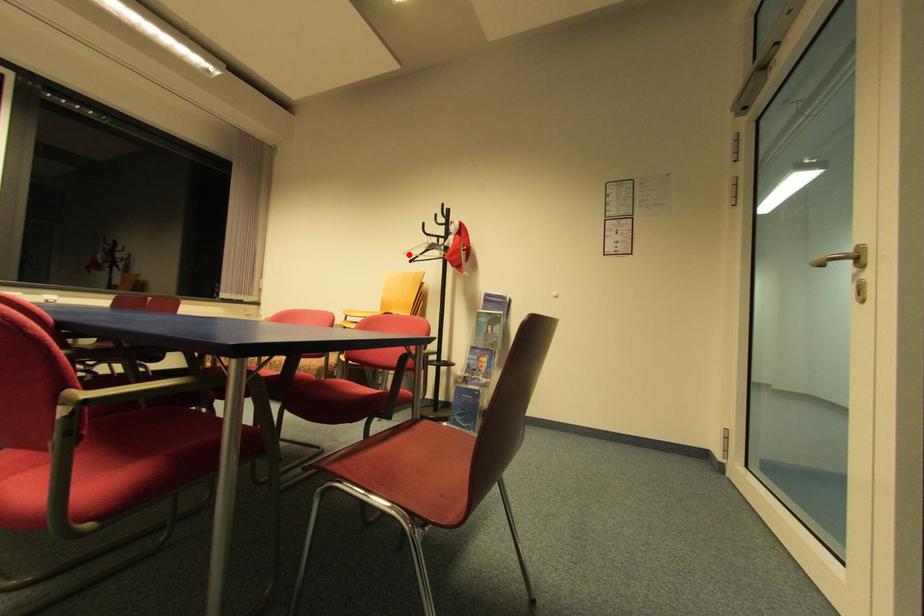
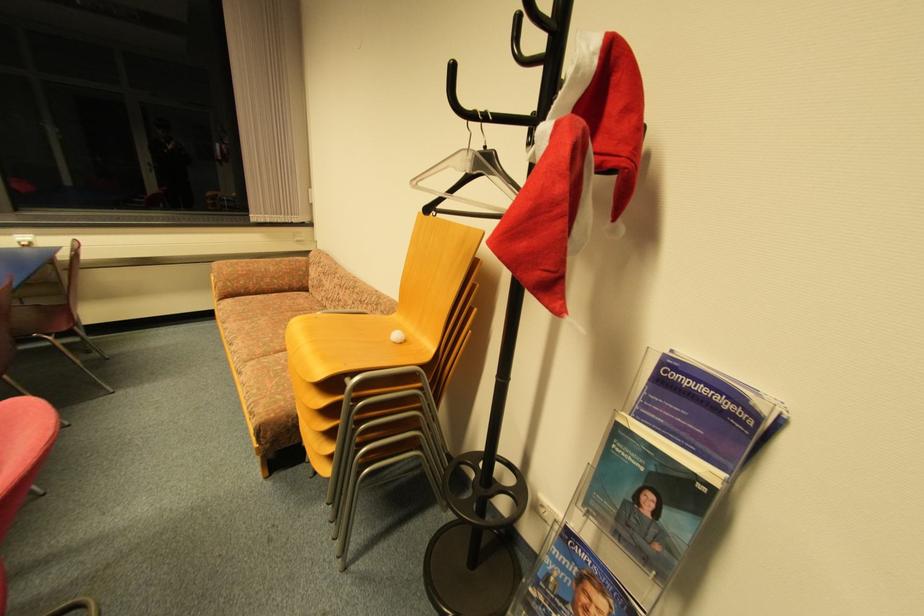
The point at the highlighted location is marked in the first image. Where is the corresponding point in the second image?

(419, 184)